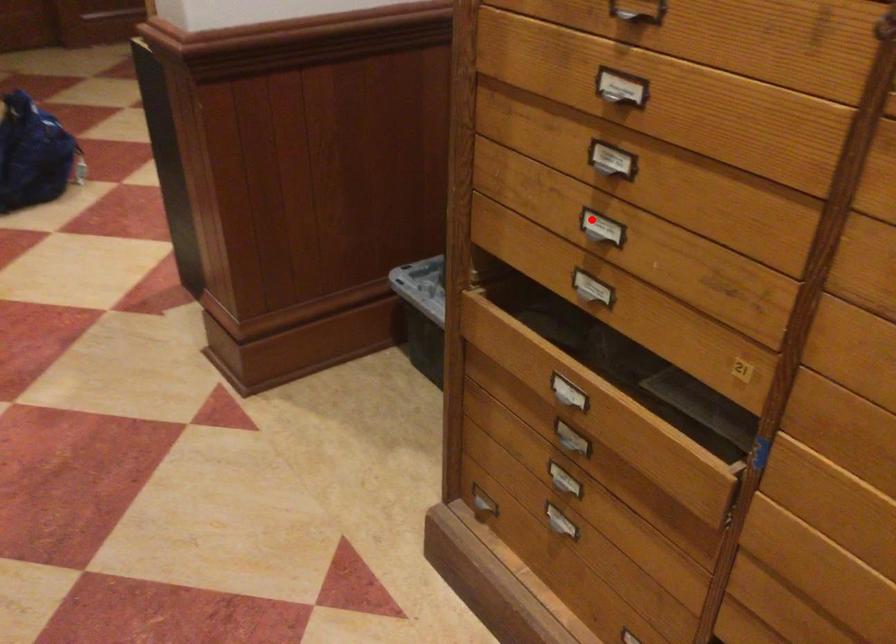
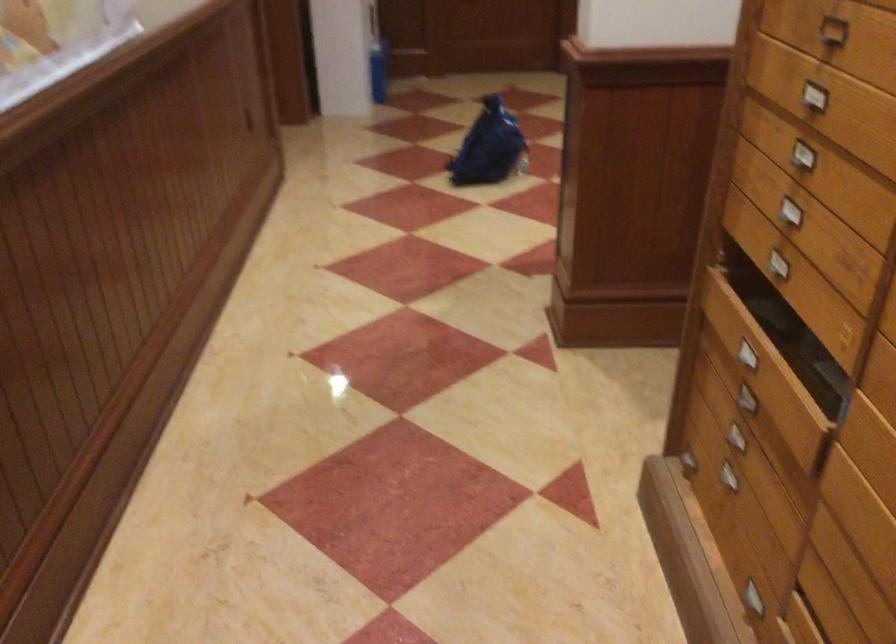
Question: I am providing you with two images of the same scene from different viewpoints. Image1 has a red point marked. In image2, the corresponding 3D location appears at what relative position? Reply with the corresponding letter.

Choices:
 (A) Closer
 (B) Farther

Answer: (B)